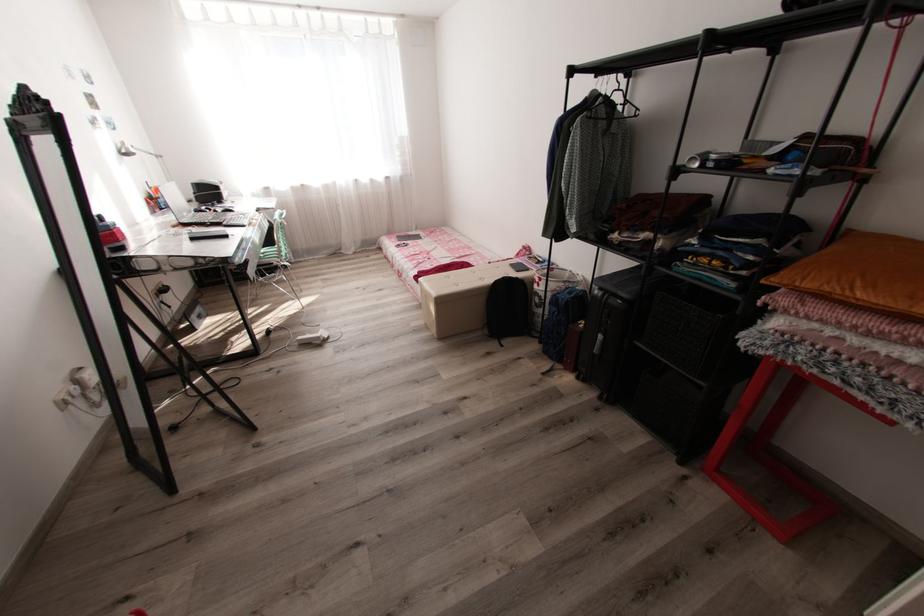
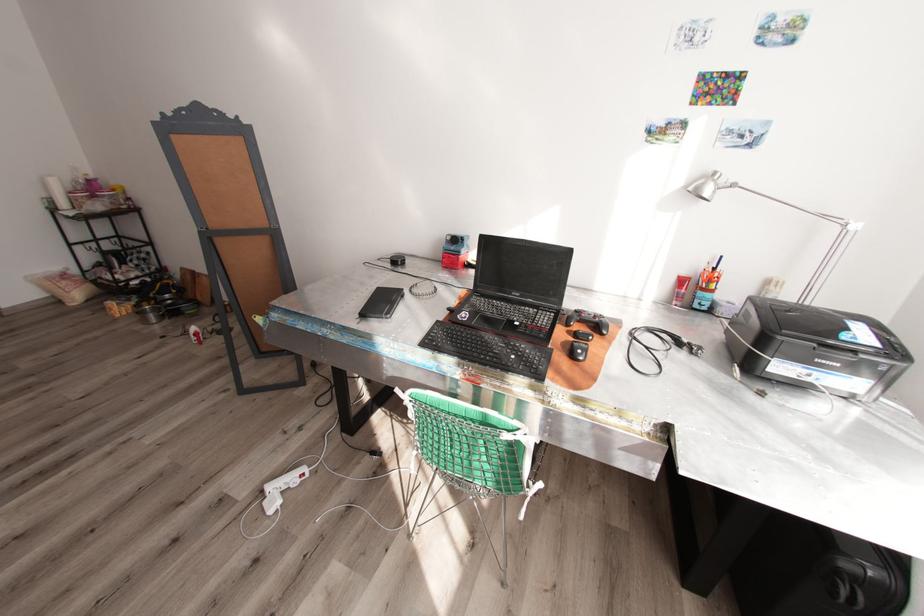
Locate, in the second image, the point that corresponds to pixel 129 151 in the first image.

(695, 188)